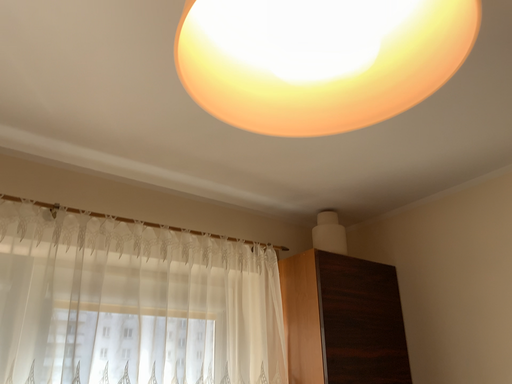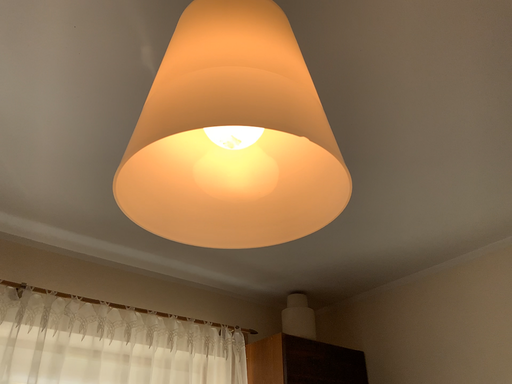
Question: How did the camera likely rotate when shooting the video?

Choices:
 (A) rotated upward
 (B) rotated downward

Answer: (A)